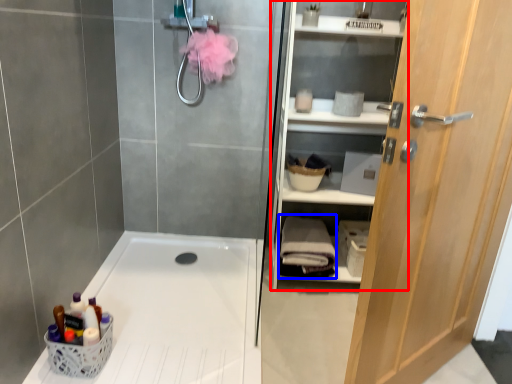
Question: Which point is further to the camera, shelf (highlighted by a red box) or bath towel (highlighted by a blue box)?

Choices:
 (A) shelf
 (B) bath towel

Answer: (B)